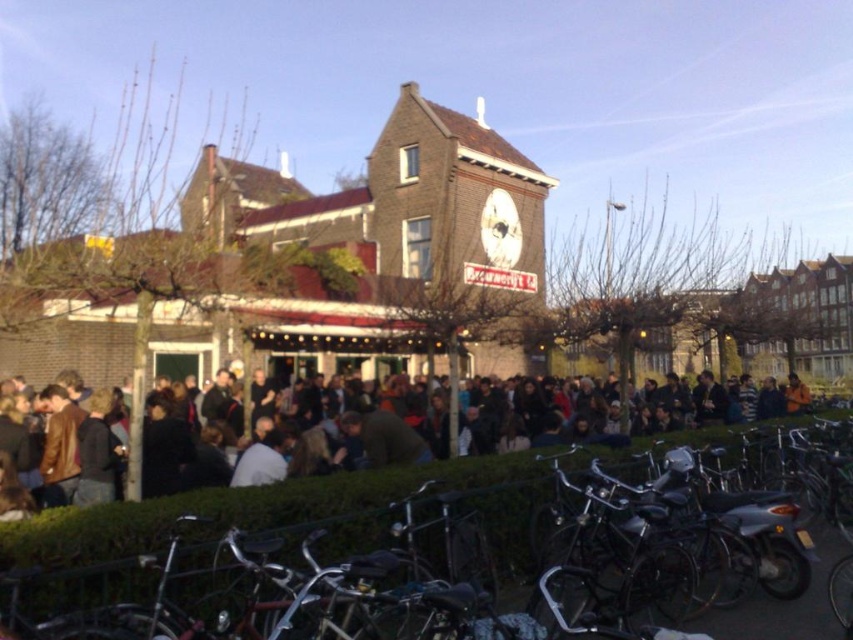
Does shiny metallic bicycle at center have a smaller size compared to dark brown leather jacket at center?

Yes, shiny metallic bicycle at center is smaller than dark brown leather jacket at center.

Can you confirm if shiny metallic bicycle at center is positioned to the right of dark brown leather jacket at center?

Correct, you'll find shiny metallic bicycle at center to the right of dark brown leather jacket at center.

What do you see at coordinates (270, 524) in the screenshot?
I see `shiny metallic bicycle at center` at bounding box center [270, 524].

Where is `shiny metallic bicycle at center`? The height and width of the screenshot is (640, 853). shiny metallic bicycle at center is located at coordinates (270, 524).